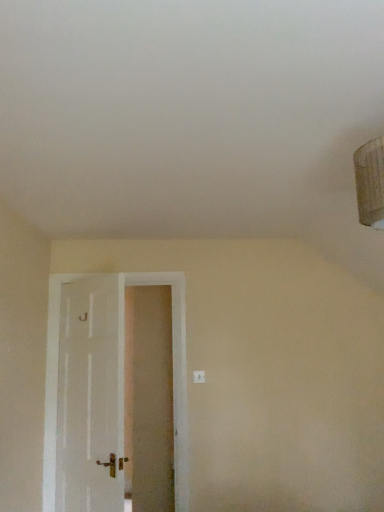
The width and height of the screenshot is (384, 512). What do you see at coordinates (174, 373) in the screenshot? I see `white painted wood door at center` at bounding box center [174, 373].

Where is `white painted wood door at center`? The height and width of the screenshot is (512, 384). white painted wood door at center is located at coordinates (174, 373).

This screenshot has height=512, width=384. I want to click on white painted wood door at center, so click(x=174, y=373).